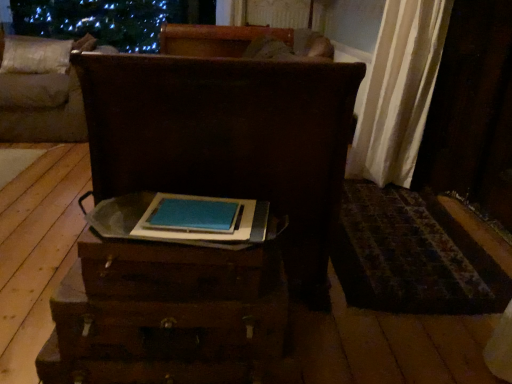
Question: From a real-world perspective, is wooden trunk at center, the first furniture when ordered from front to back, above or below beige fabric pillow at upper left?

Choices:
 (A) above
 (B) below

Answer: (B)

Question: Is point (143, 66) positioned closer to the camera than point (47, 71)?

Choices:
 (A) farther
 (B) closer

Answer: (B)

Question: Based on their relative distances, which object is farther from the wooden trunk at center, the second furniture viewed from the left?

Choices:
 (A) beige fabric pillow at upper left
 (B) blue matte book at center
 (C) brown wooden chest at upper left, acting as the 1th furniture starting from the back
 (D) wooden drawer at center

Answer: (A)

Question: Considering the real-world distances, which object is farthest from the beige fabric pillow at upper left?

Choices:
 (A) wooden trunk at center, marked as the first furniture in a right-to-left arrangement
 (B) brown wooden chest at upper left, the second furniture viewed from the front
 (C) blue matte book at center
 (D) wooden drawer at center

Answer: (D)